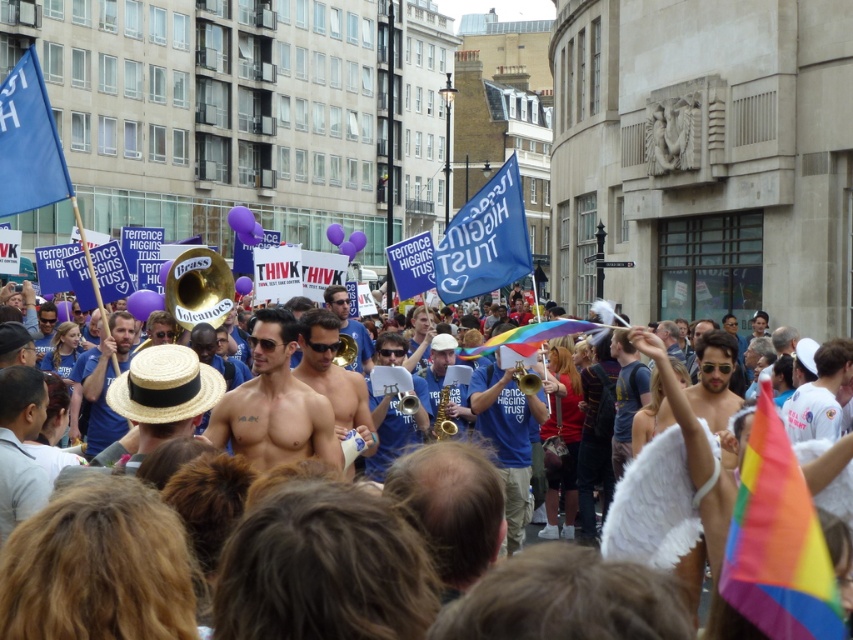
Question: Which of the following is the farthest from the observer?

Choices:
 (A) blue shirt at center
 (B) smooth skin torso at center
 (C) shiny gold saxophone at center

Answer: (C)

Question: Is blue cotton shirt at center smaller than shiny gold trumpet at center?

Choices:
 (A) no
 (B) yes

Answer: (A)

Question: Among these points, which one is farthest from the camera?

Choices:
 (A) (172, 413)
 (B) (476, 385)

Answer: (B)

Question: Is blue shirt at center positioned behind gold shiny trumpet at center?

Choices:
 (A) yes
 (B) no

Answer: (B)

Question: Does blue cotton shirt at center appear on the right side of shiny gold saxophone at center?

Choices:
 (A) no
 (B) yes

Answer: (B)

Question: Considering the real-world distances, which object is closest to the shiny gold saxophone at center?

Choices:
 (A) gold shiny trumpet at center
 (B) blue fabric flag at center
 (C) straw hat at center
 (D) shiny skin torso at center

Answer: (A)